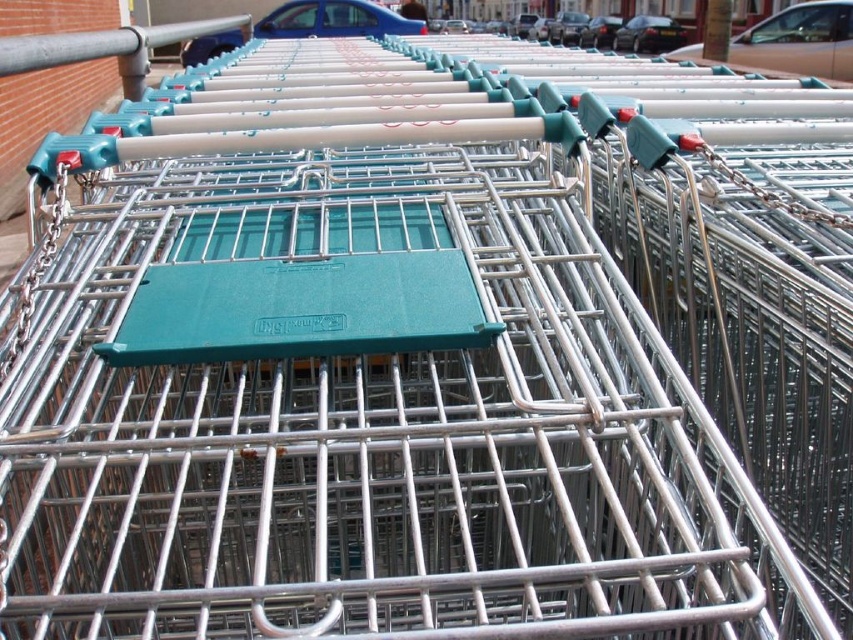
You are standing in front of the row of shopping carts and looking towards the street. Which car, the blue metallic car at upper center or the black glossy car at center, is nearer to you?

The blue metallic car at upper center is closer to the viewer than the black glossy car at center.

You are a delivery driver who needs to park your van between the brown matte car at upper center and the blue metallic car at upper center. Which car should you place your van closer to if you want to maximize the available space for your vehicle?

You should place your van closer to the brown matte car at upper center because it is smaller compared to the blue metallic car at upper center, allowing more space for your vehicle.

You are a delivery person who needs to park a new van between the brown matte car at upper center and the blue metallic car at upper center. Which car should you place the van closer to if you want to avoid blocking the view of the taller vehicle?

You should place the van closer to the brown matte car at upper center because it is taller than the blue metallic car at upper center, so positioning the van near the taller car would help avoid blocking its view.